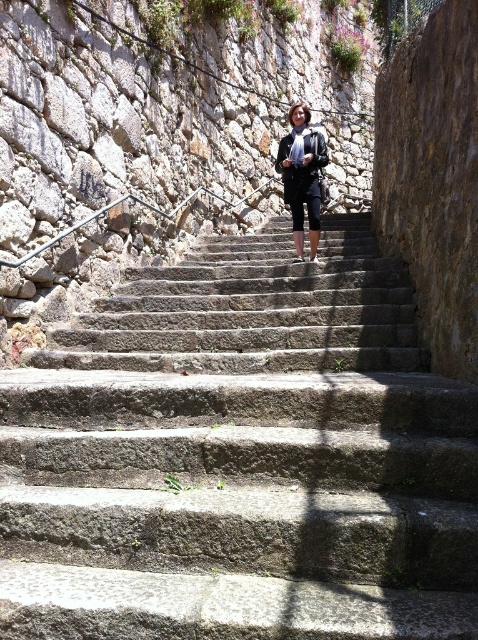
Question: Does gray stone stairs at center appear on the left side of black leather jacket at center?

Choices:
 (A) yes
 (B) no

Answer: (A)

Question: Which point is closer to the camera?

Choices:
 (A) gray stone stairs at center
 (B) black leather jacket at center

Answer: (A)

Question: Which point is closer to the camera?

Choices:
 (A) (286, 196)
 (B) (178, 579)

Answer: (B)

Question: Does gray stone stairs at center have a lesser width compared to black leather jacket at center?

Choices:
 (A) no
 (B) yes

Answer: (A)

Question: Does gray stone stairs at center have a greater width compared to black leather jacket at center?

Choices:
 (A) yes
 (B) no

Answer: (A)

Question: Which of the following is the farthest from the observer?

Choices:
 (A) (422, 564)
 (B) (286, 148)

Answer: (B)